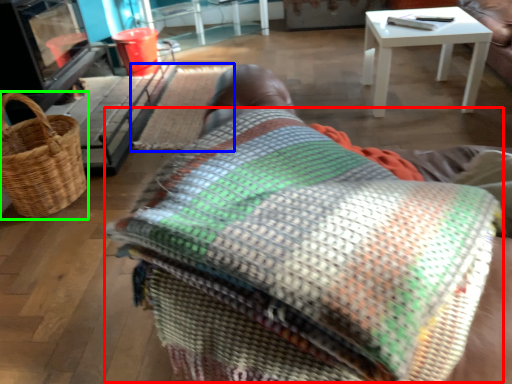
Question: Which object is the farthest from blanket (highlighted by a red box)? Choose among these: mat (highlighted by a blue box) or picnic basket (highlighted by a green box).

Choices:
 (A) mat
 (B) picnic basket

Answer: (A)